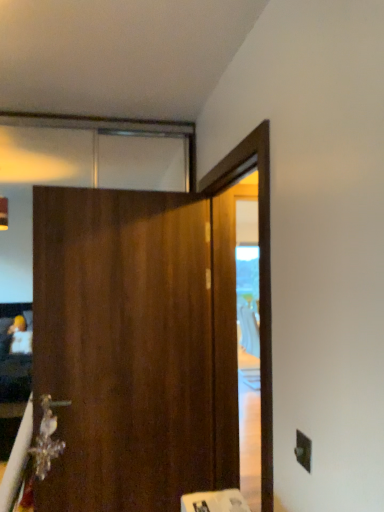
Question: Is wooden barn door at center wider or thinner than metallic crystal at lower left?

Choices:
 (A) thin
 (B) wide

Answer: (B)

Question: From the image's perspective, is wooden barn door at center located above or below metallic crystal at lower left?

Choices:
 (A) above
 (B) below

Answer: (A)

Question: Considering the real-world distances, which object is closest to the metallic crystal at lower left?

Choices:
 (A) black plastic electric outlet at lower right
 (B) wooden barn door at center

Answer: (B)

Question: Which object is positioned closest to the wooden barn door at center?

Choices:
 (A) metallic crystal at lower left
 (B) black plastic electric outlet at lower right

Answer: (A)